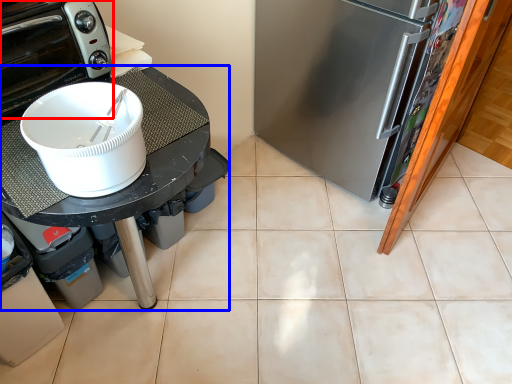
Question: Which object appears closest to the camera in this image, home appliance (highlighted by a red box) or table (highlighted by a blue box)?

Choices:
 (A) home appliance
 (B) table

Answer: (B)